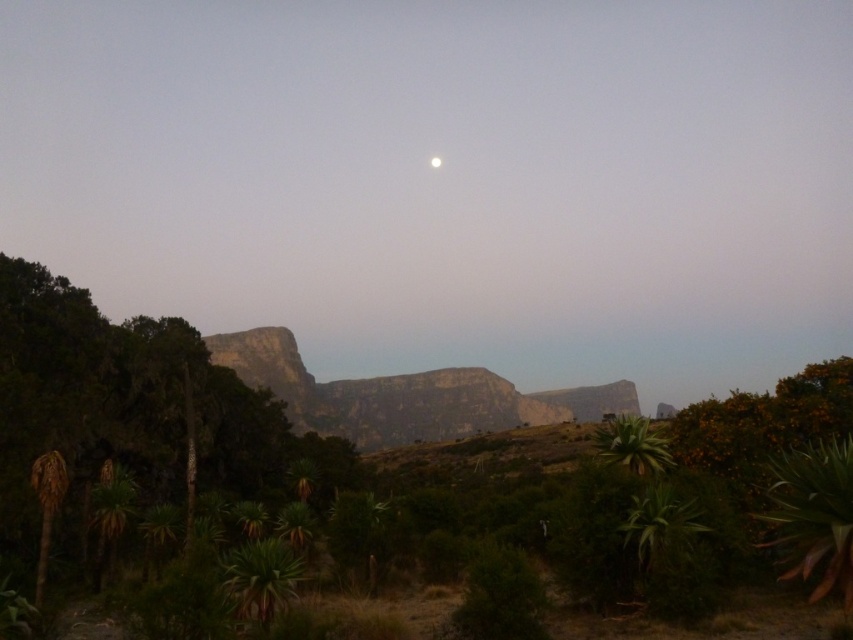
Can you confirm if rocky cliff at center is shorter than green leafy plant at lower right?

No.

Is point (334, 424) less distant than point (788, 509)?

No.

Identify the location of rocky cliff at center. The image size is (853, 640). (404, 396).

The width and height of the screenshot is (853, 640). Describe the element at coordinates (814, 515) in the screenshot. I see `green leafy plant at lower right` at that location.

Is green leafy plant at lower right bigger than green succulent plant at lower right?

No, green leafy plant at lower right is not bigger than green succulent plant at lower right.

Between point (844, 600) and point (604, 426), which one is positioned in front?

Point (844, 600) is in front.

The image size is (853, 640). What are the coordinates of `green leafy plant at lower right` in the screenshot? It's located at (814, 515).

Find the location of `green leafy plant at lower right`. green leafy plant at lower right is located at coordinates (814, 515).

Describe the element at coordinates (814, 515) in the screenshot. The height and width of the screenshot is (640, 853). I see `green leafy plant at lower right` at that location.

You are a GUI agent. You are given a task and a screenshot of the screen. Output one action in this format:
    pyautogui.click(x=<x>, y=<y>)
    Task: Click on the green leafy plant at lower right
    The image size is (853, 640).
    Given the screenshot: What is the action you would take?
    pyautogui.click(x=814, y=515)